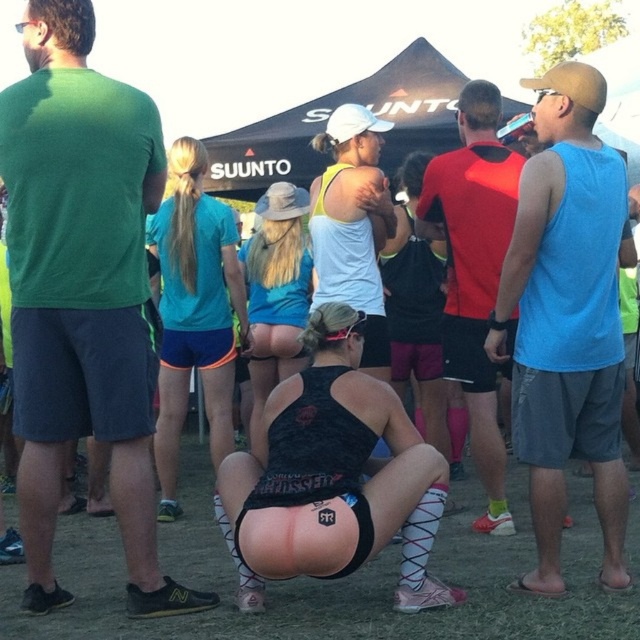
Who is more distant from viewer, [486,512] or [360,266]?

The point [486,512] is more distant.

Can you confirm if red shirt at center is thinner than white matte tank top at center?

No.

Is point (432, 192) less distant than point (320, 230)?

No, (432, 192) is further to viewer.

Identify the location of red shirt at center. This screenshot has height=640, width=640. (474, 273).

Is green fabric shirt at left further to camera compared to teal fabric shorts at center?

That is False.

Is point (92, 122) positioned before point (166, 252)?

Yes, it is in front of point (166, 252).

In order to click on green fabric shirt at left in this screenshot , I will do `click(83, 292)`.

Is teal fabric shorts at center smaller than matte blue tank top at center?

No, teal fabric shorts at center is not smaller than matte blue tank top at center.

Does teal fabric shorts at center have a lesser height compared to matte blue tank top at center?

In fact, teal fabric shorts at center may be taller than matte blue tank top at center.

Image resolution: width=640 pixels, height=640 pixels. What are the coordinates of `teal fabric shorts at center` in the screenshot? It's located at (195, 312).

At what (x,y) coordinates should I click in order to perform the action: click on teal fabric shorts at center. Please return your answer as a coordinate pair (x, y). This screenshot has height=640, width=640. Looking at the image, I should click on (195, 312).